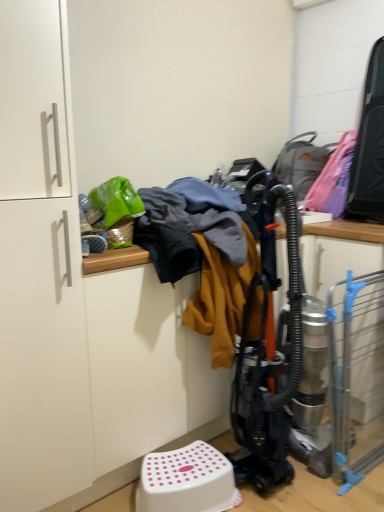
Where is `vacant space situated above white plastic step stool at lower center (from a real-world perspective)`? The width and height of the screenshot is (384, 512). vacant space situated above white plastic step stool at lower center (from a real-world perspective) is located at coordinates (183, 463).